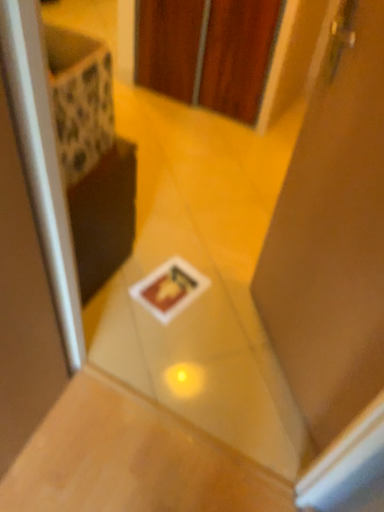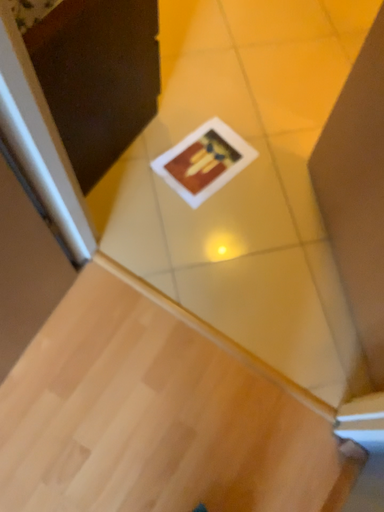
Question: Which way did the camera rotate in the video?

Choices:
 (A) rotated right
 (B) rotated left

Answer: (B)